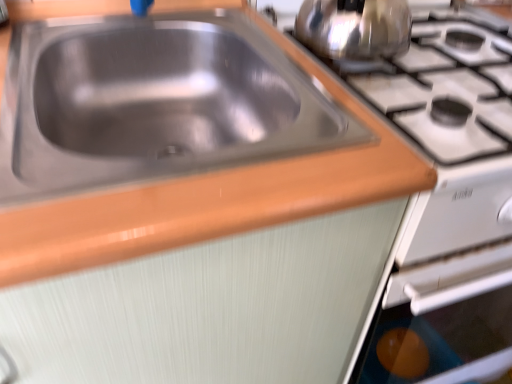
Question: Is stainless steel sink at upper left positioned in front of shiny metallic kettle at upper right?

Choices:
 (A) yes
 (B) no

Answer: (A)

Question: Can shiny metallic kettle at upper right be found inside stainless steel sink at upper left?

Choices:
 (A) yes
 (B) no

Answer: (B)

Question: Is stainless steel sink at upper left shorter than shiny metallic kettle at upper right?

Choices:
 (A) yes
 (B) no

Answer: (A)

Question: From the image's perspective, would you say stainless steel sink at upper left is shown under shiny metallic kettle at upper right?

Choices:
 (A) yes
 (B) no

Answer: (A)

Question: Can you confirm if stainless steel sink at upper left is smaller than shiny metallic kettle at upper right?

Choices:
 (A) no
 (B) yes

Answer: (A)

Question: Does stainless steel sink at upper left have a lesser width compared to shiny metallic kettle at upper right?

Choices:
 (A) no
 (B) yes

Answer: (A)

Question: Is stainless steel sink at upper left completely or partially inside shiny metallic kettle at upper right?

Choices:
 (A) no
 (B) yes

Answer: (A)

Question: Can you confirm if shiny metallic kettle at upper right is positioned to the right of stainless steel sink at upper left?

Choices:
 (A) no
 (B) yes

Answer: (B)

Question: From the image's perspective, would you say shiny metallic kettle at upper right is shown under stainless steel sink at upper left?

Choices:
 (A) no
 (B) yes

Answer: (A)

Question: Does shiny metallic kettle at upper right have a smaller size compared to stainless steel sink at upper left?

Choices:
 (A) yes
 (B) no

Answer: (A)

Question: Is shiny metallic kettle at upper right wider than stainless steel sink at upper left?

Choices:
 (A) yes
 (B) no

Answer: (B)

Question: From a real-world perspective, is shiny metallic kettle at upper right beneath stainless steel sink at upper left?

Choices:
 (A) no
 (B) yes

Answer: (A)

Question: Relative to shiny metallic kettle at upper right, is stainless steel sink at upper left in front or behind?

Choices:
 (A) behind
 (B) front

Answer: (B)